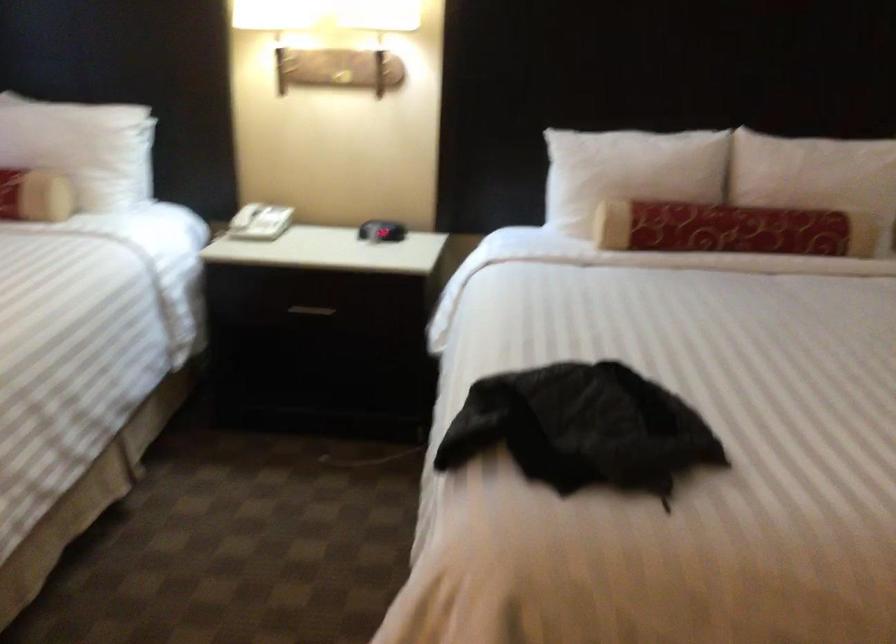
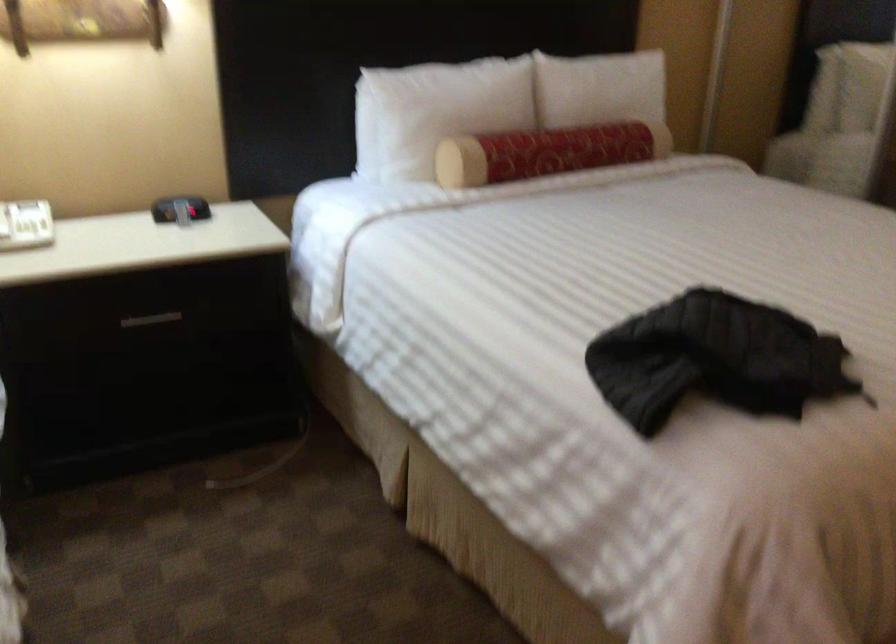
Find the pixel in the second image that matches (x=366, y=225) in the first image.

(179, 209)